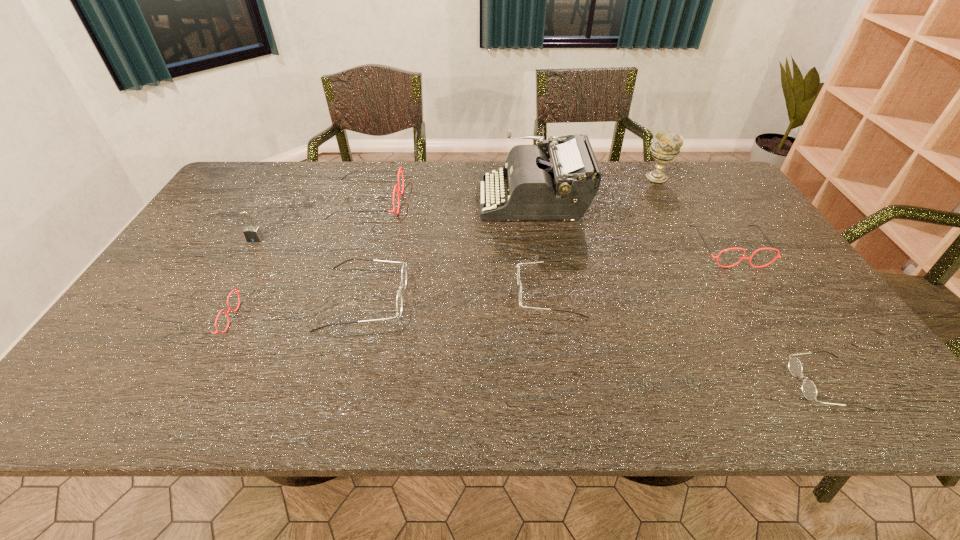
This screenshot has width=960, height=540. In order to click on free space located 0.100m on the front-facing side of the tallest spectacles in this screenshot , I will do `click(433, 202)`.

Where is `vacant area located on the front-facing side of the second farthest spectacles`? This screenshot has height=540, width=960. vacant area located on the front-facing side of the second farthest spectacles is located at coordinates (762, 301).

This screenshot has width=960, height=540. What are the coordinates of `free space located through the lenses of the leftmost dark spectacles` in the screenshot? It's located at (434, 299).

Identify the location of vacant space positioned through the lenses of the fourth spectacles from left to right. This screenshot has width=960, height=540. (358, 293).

The height and width of the screenshot is (540, 960). I want to click on vacant region located 0.080m through the lenses of the fourth spectacles from left to right, so click(x=485, y=293).

In order to click on free spot located through the lenses of the fourth spectacles from left to right in this screenshot , I will do `click(377, 293)`.

Image resolution: width=960 pixels, height=540 pixels. I want to click on vacant area situated on the front-facing side of the smallest red spectacles, so click(271, 319).

I want to click on vacant position located 0.400m through the lenses of the rightmost dark spectacles, so click(x=604, y=384).

Find the location of a particular element. This screenshot has height=540, width=960. free location located through the lenses of the rightmost dark spectacles is located at coordinates (628, 384).

The width and height of the screenshot is (960, 540). In order to click on vacant space located through the lenses of the rightmost dark spectacles in this screenshot , I will do `click(613, 384)`.